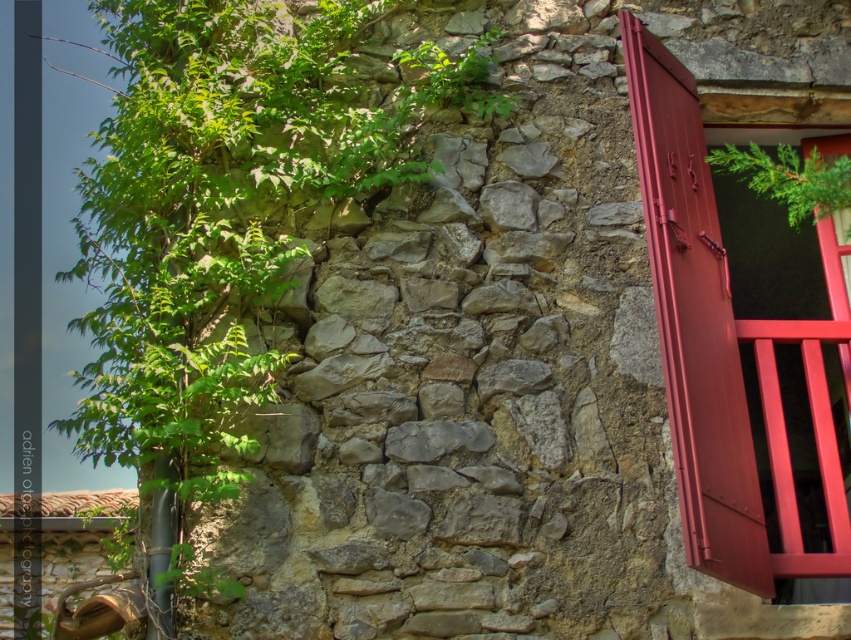
Question: Which object appears closest to the camera in this image?

Choices:
 (A) green leafy plant at upper left
 (B) matte red wooden door at right

Answer: (B)

Question: Among these points, which one is nearest to the camera?

Choices:
 (A) (769, 186)
 (B) (701, 276)

Answer: (B)

Question: Can you confirm if green leafy plant at upper left is bigger than green leafy plant at upper right?

Choices:
 (A) yes
 (B) no

Answer: (A)

Question: Where is green leafy plant at upper left located in relation to matte red wooden door at right in the image?

Choices:
 (A) left
 (B) right

Answer: (A)

Question: Which object is the farthest from the green leafy plant at upper left?

Choices:
 (A) green leafy plant at upper right
 (B) matte red wooden door at right

Answer: (A)

Question: Does matte red wooden door at right appear over green leafy plant at upper right?

Choices:
 (A) yes
 (B) no

Answer: (B)